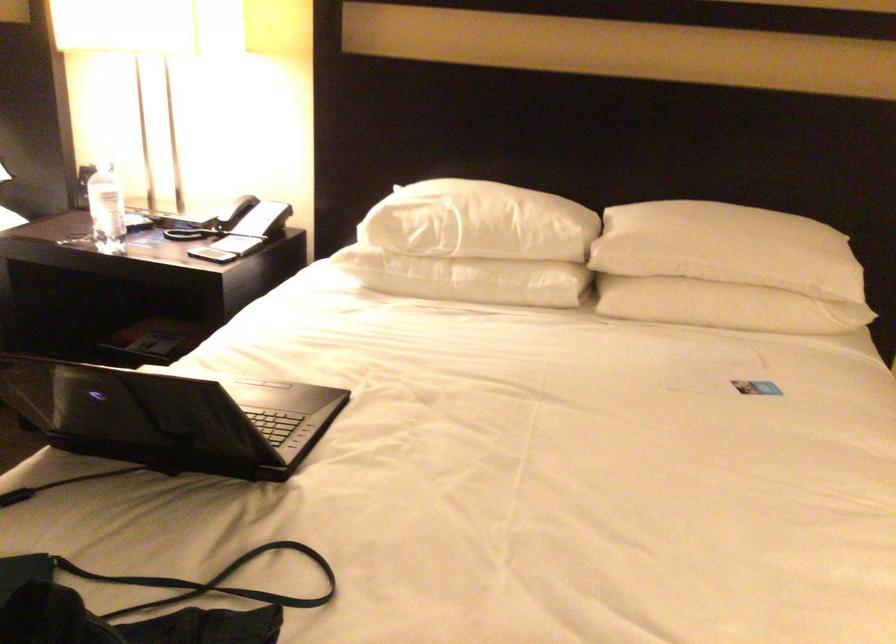
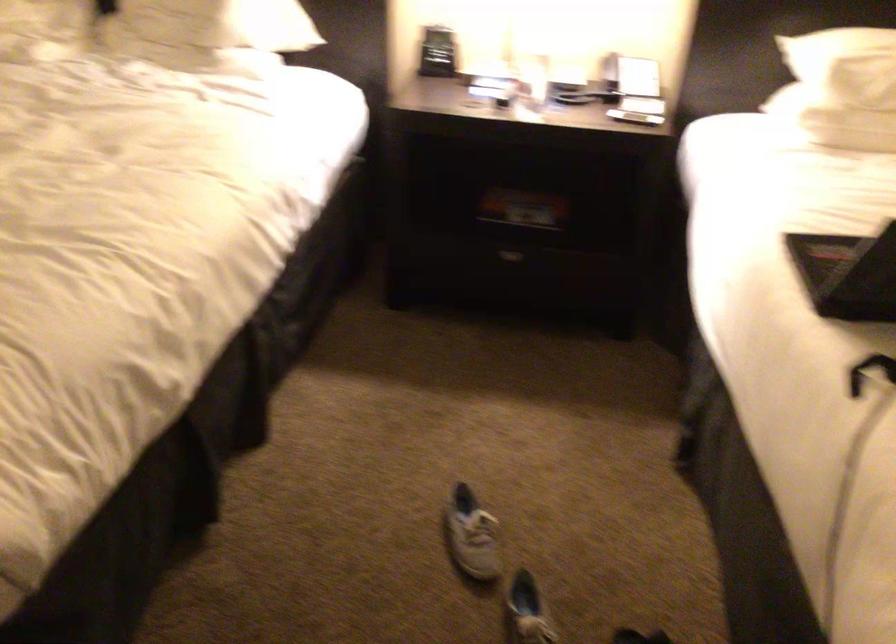
Question: What movement of the cameraman would produce the second image?

Choices:
 (A) Left
 (B) Right
 (C) Forward
 (D) Backward

Answer: (A)